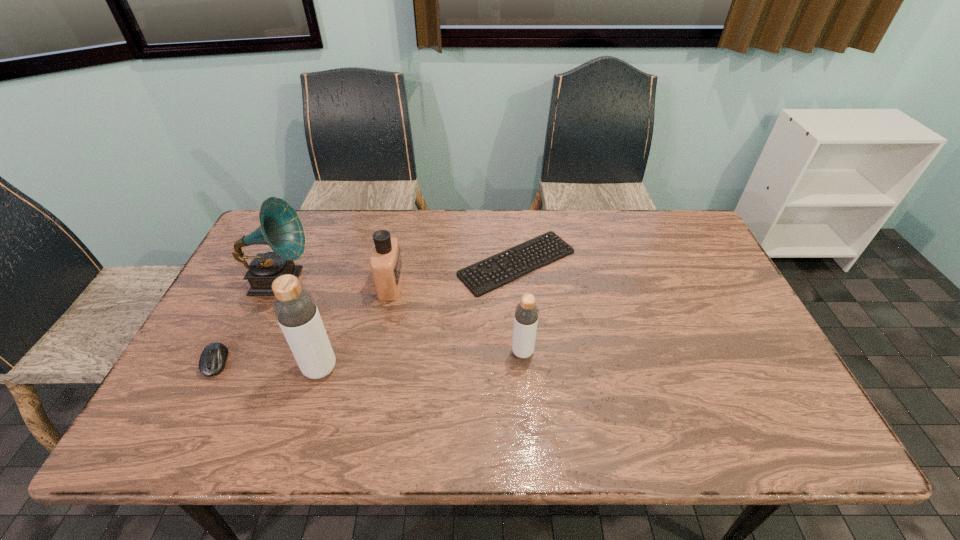
I want to click on free space located 0.090m on the left of the computer keyboard, so click(428, 263).

Find the location of `blank space located from the horn of the phonograph_record`. blank space located from the horn of the phonograph_record is located at coordinates (372, 281).

Find the location of a particular element. The width and height of the screenshot is (960, 540). vacant area located on the back of the mouse is located at coordinates (249, 299).

Identify the location of object that is at the far edge. The image size is (960, 540). (550, 245).

You are a GUI agent. You are given a task and a screenshot of the screen. Output one action in this format:
    pyautogui.click(x=<x>, y=<y>)
    Task: Click on the bottle that is at the near edge
    This screenshot has height=540, width=960.
    Given the screenshot: What is the action you would take?
    pyautogui.click(x=294, y=307)

Identify the location of mouse located in the near edge section of the desktop. (212, 361).

Where is `phonograph_record that is at the left edge`? Image resolution: width=960 pixels, height=540 pixels. phonograph_record that is at the left edge is located at coordinates (280, 227).

Where is `mouse positioned at the left edge`? mouse positioned at the left edge is located at coordinates (212, 361).

This screenshot has width=960, height=540. I want to click on object present at the near left corner, so click(x=212, y=361).

Find the location of a particular element. Image resolution: width=960 pixels, height=540 pixels. vacant space at the far edge of the desktop is located at coordinates (570, 229).